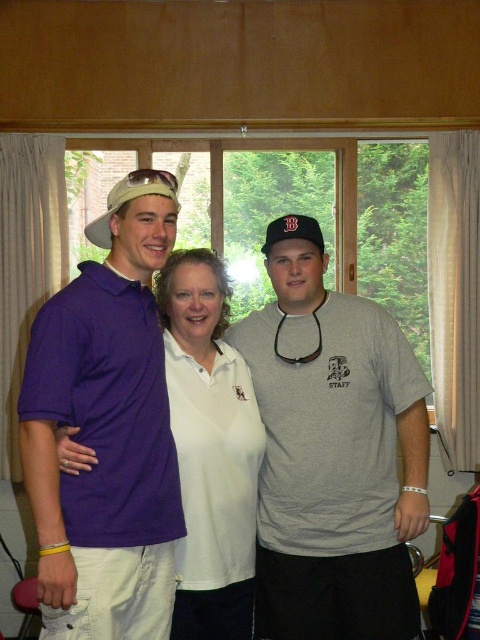
You are a photographer setting up a shoot in the room. You need to ensure that the purple matte polo shirt at left and the white smooth shirt at center are visible in the frame. Based on their heights, which one might need to be positioned closer to the camera to ensure both are fully visible?

The white smooth shirt at center is shorter than the purple matte polo shirt at left, so positioning it closer to the camera would help ensure both are fully visible.

You are a photographer setting up a shoot in this room. You need to ensure that all subjects are visible in the frame. Given that the purple matte polo shirt at left and the white smooth shirt at center are of different sizes, which shirt should be positioned closer to the camera to maintain proportional balance in the photo?

The purple matte polo shirt at left is larger in size than the white smooth shirt at center. To maintain proportional balance, the smaller white smooth shirt at center should be positioned closer to the camera so that both appear similarly sized in the final photograph.